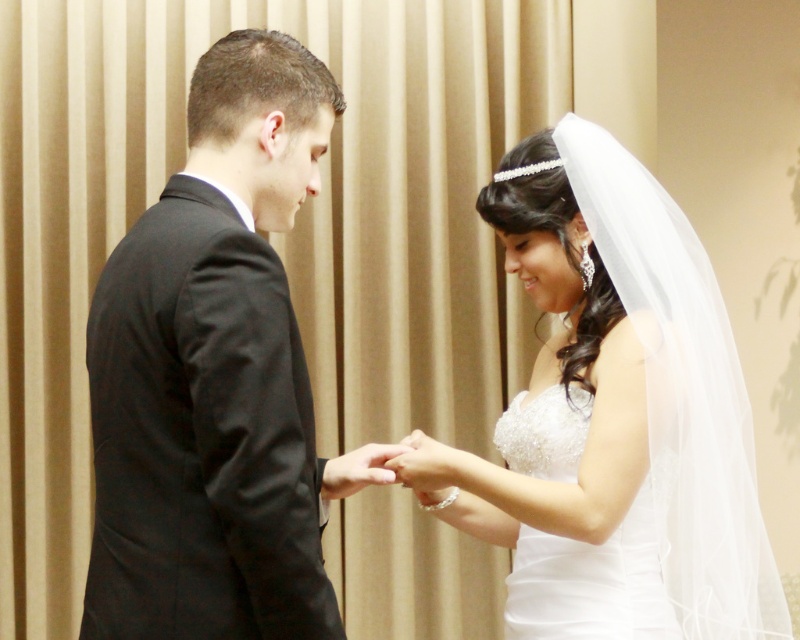
Question: Which object is closer to the camera taking this photo?

Choices:
 (A) white satin dress at center
 (B) white satin hand at center
 (C) black satin suit at left
 (D) pearl white lace hand at center

Answer: (C)

Question: Which of the following is the closest to the observer?

Choices:
 (A) white satin wedding dress at center
 (B) white satin dress at center

Answer: (B)

Question: Where is pearl white lace hand at center located in relation to white satin hand at center in the image?

Choices:
 (A) right
 (B) left

Answer: (A)

Question: Does black satin suit at left lie in front of white satin wedding dress at center?

Choices:
 (A) yes
 (B) no

Answer: (A)

Question: Can you confirm if black satin suit at left is positioned to the left of white satin hand at center?

Choices:
 (A) yes
 (B) no

Answer: (A)

Question: Which point is farther to the camera?

Choices:
 (A) white satin hand at center
 (B) white satin dress at center
 (C) black satin suit at left
 (D) white satin wedding dress at center

Answer: (A)